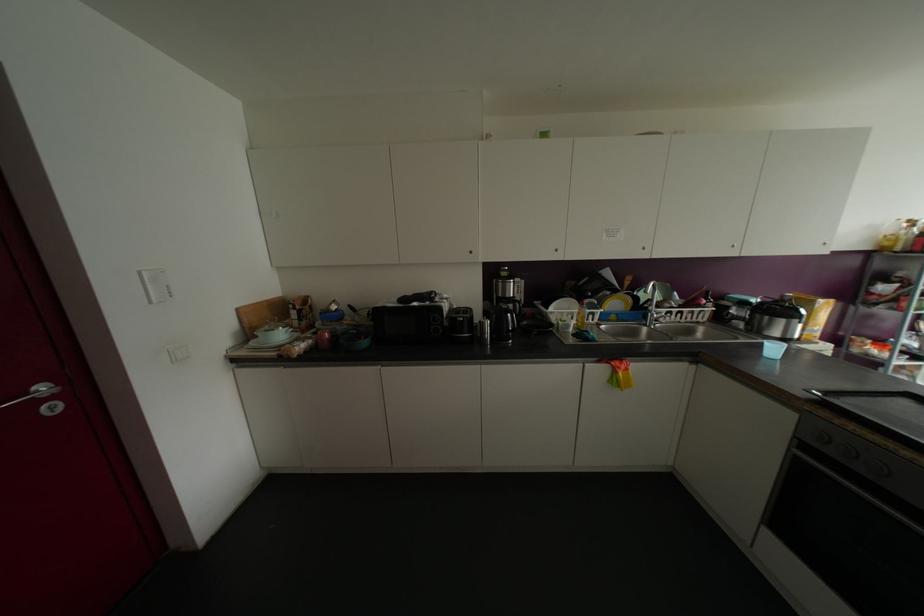
I want to click on silver faucet handle, so click(x=665, y=315).